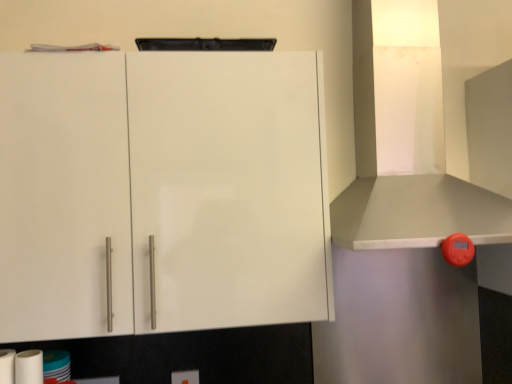
Question: From a real-world perspective, does white matte paper towel at lower left, the 2th paper towel viewed from the left, sit lower than white glossy toilet paper at lower left?

Choices:
 (A) yes
 (B) no

Answer: (B)

Question: Does white matte paper towel at lower left, arranged as the first paper towel when viewed from the right, have a smaller size compared to white glossy toilet paper at lower left?

Choices:
 (A) no
 (B) yes

Answer: (B)

Question: Does white matte paper towel at lower left, arranged as the first paper towel when viewed from the right, have a greater width compared to white glossy toilet paper at lower left?

Choices:
 (A) no
 (B) yes

Answer: (A)

Question: Is white matte paper towel at lower left, the 2th paper towel viewed from the left, directly adjacent to white glossy toilet paper at lower left?

Choices:
 (A) no
 (B) yes

Answer: (B)

Question: From a real-world perspective, is white matte paper towel at lower left, the 2th paper towel viewed from the left, on white glossy toilet paper at lower left?

Choices:
 (A) no
 (B) yes

Answer: (B)

Question: Considering their positions, is white glossy cabinet at upper left located in front of or behind white matte paper towel at lower left, the 1th paper towel from the left?

Choices:
 (A) behind
 (B) front

Answer: (A)

Question: From a real-world perspective, is white glossy cabinet at upper left physically located above or below white matte paper towel at lower left, the 2th paper towel in the right-to-left sequence?

Choices:
 (A) below
 (B) above

Answer: (B)

Question: Based on their positions, is white glossy cabinet at upper left located to the left or right of white matte paper towel at lower left, the 1th paper towel from the left?

Choices:
 (A) left
 (B) right

Answer: (B)

Question: Considering the positions of white glossy cabinet at upper left and white matte paper towel at lower left, the 1th paper towel from the left, in the image, is white glossy cabinet at upper left taller or shorter than white matte paper towel at lower left, the 1th paper towel from the left,?

Choices:
 (A) short
 (B) tall

Answer: (B)

Question: Is white matte paper towel at lower left, the 2th paper towel in the right-to-left sequence, inside or outside of white glossy cabinet at upper left?

Choices:
 (A) inside
 (B) outside

Answer: (B)

Question: Looking at the image, does white matte paper towel at lower left, the 2th paper towel in the right-to-left sequence, seem bigger or smaller compared to white glossy cabinet at upper left?

Choices:
 (A) small
 (B) big

Answer: (A)

Question: Is white matte paper towel at lower left, the 2th paper towel in the right-to-left sequence, to the left or to the right of white glossy cabinet at upper left in the image?

Choices:
 (A) right
 (B) left

Answer: (B)

Question: Does point (4, 372) appear closer or farther from the camera than point (291, 71)?

Choices:
 (A) farther
 (B) closer

Answer: (B)

Question: Relative to white matte paper towel at lower left, arranged as the first paper towel when viewed from the right, is white glossy toilet paper at lower left in front or behind?

Choices:
 (A) front
 (B) behind

Answer: (B)

Question: Does point (66, 364) appear closer or farther from the camera than point (20, 352)?

Choices:
 (A) closer
 (B) farther

Answer: (B)